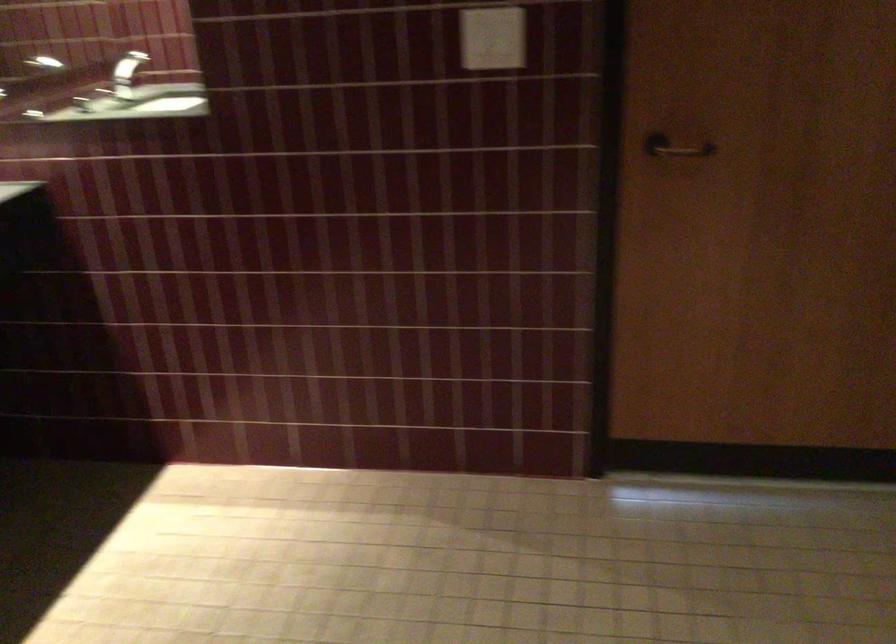
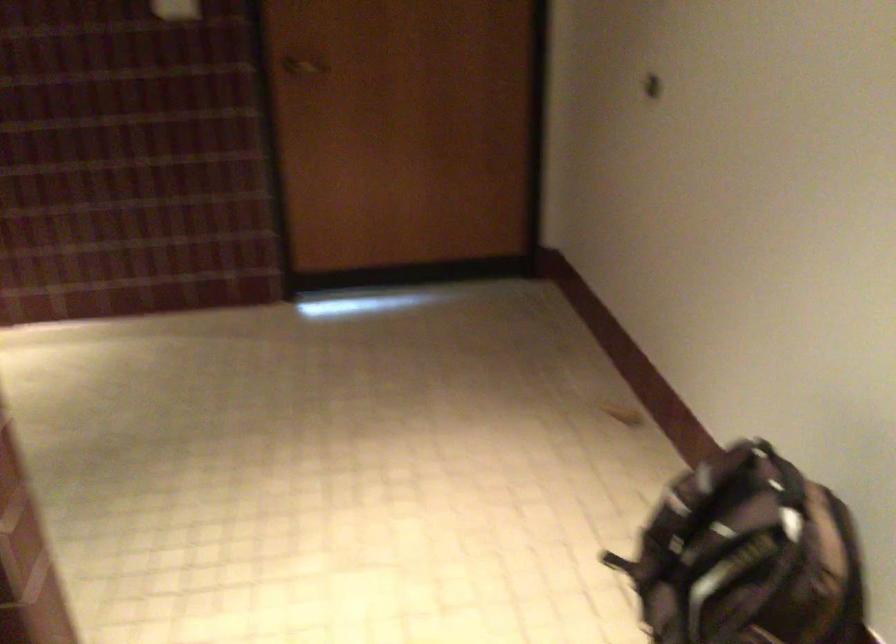
Where in the second image is the point corresponding to (668,147) from the first image?

(304, 66)